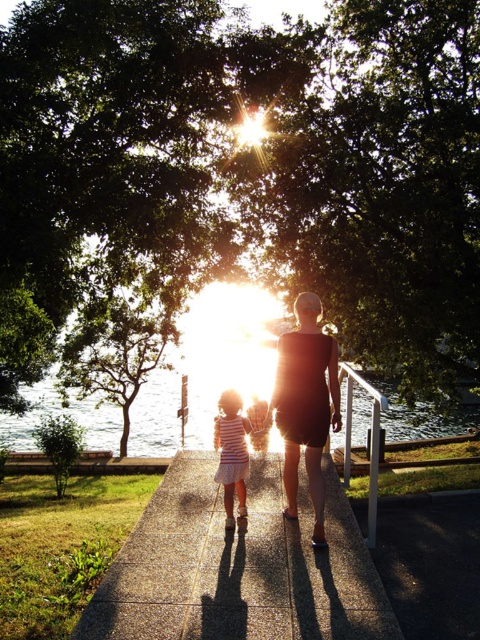
You are standing at the edge of the scene and want to walk towards the water. You see the concrete sidewalk at center and the striped fabric dress at center. Which object will you encounter first as you walk towards the water?

The concrete sidewalk at center is in front of the striped fabric dress at center, so you will encounter the concrete sidewalk at center first as you walk towards the water.

You are a delivery robot with a 36 inch wide package. You need to move along the concrete sidewalk at center while avoiding the black matte dress at center. Is there enough space for you to pass safely?

The concrete sidewalk at center and black matte dress at center are 37.36 inches apart from each other. Since the package is 36 inches wide, there is enough space to pass safely as 37.36 inches is greater than 36 inches.